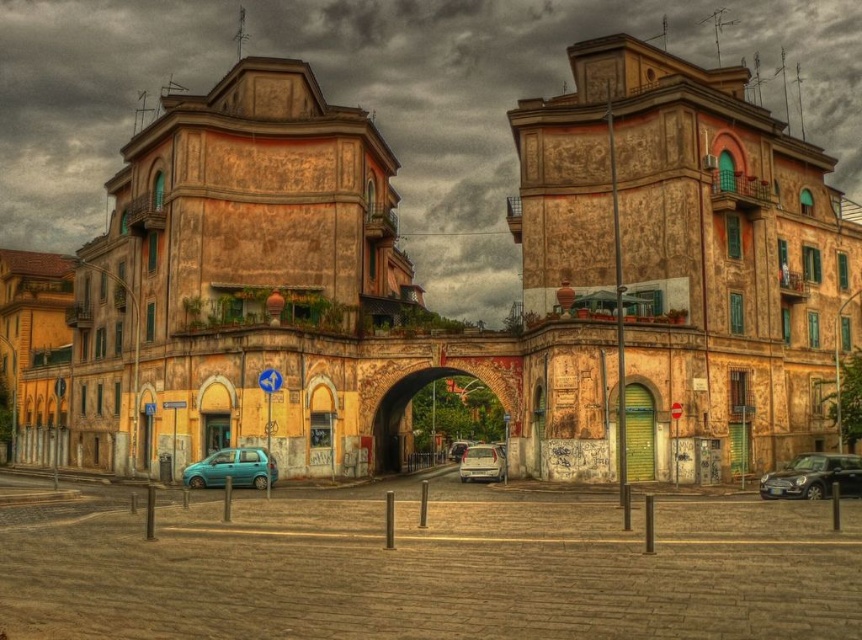
Who is higher up, teal matte hatchback at lower left or matte silver van at center?

teal matte hatchback at lower left is higher up.

From the picture: Is teal matte hatchback at lower left taller than matte silver van at center?

Correct, teal matte hatchback at lower left is much taller as matte silver van at center.

Between point (261, 472) and point (448, 456), which one is positioned behind?

Point (448, 456)

Identify the location of teal matte hatchback at lower left. This screenshot has height=640, width=862. click(230, 468).

Is metallic silver hatchback at center below matte silver van at center?

No, metallic silver hatchback at center is not below matte silver van at center.

Who is higher up, metallic silver hatchback at center or matte silver van at center?

Positioned higher is metallic silver hatchback at center.

What do you see at coordinates (813, 476) in the screenshot? The width and height of the screenshot is (862, 640). I see `metallic silver hatchback at center` at bounding box center [813, 476].

Locate an element on the screen. This screenshot has width=862, height=640. metallic silver hatchback at center is located at coordinates (813, 476).

The image size is (862, 640). Describe the element at coordinates (422, 387) in the screenshot. I see `rustic stone archway at center` at that location.

Does point (378, 424) come farther from viewer compared to point (467, 444)?

No, it is in front of (467, 444).

The height and width of the screenshot is (640, 862). Find the location of `rustic stone archway at center`. rustic stone archway at center is located at coordinates (422, 387).